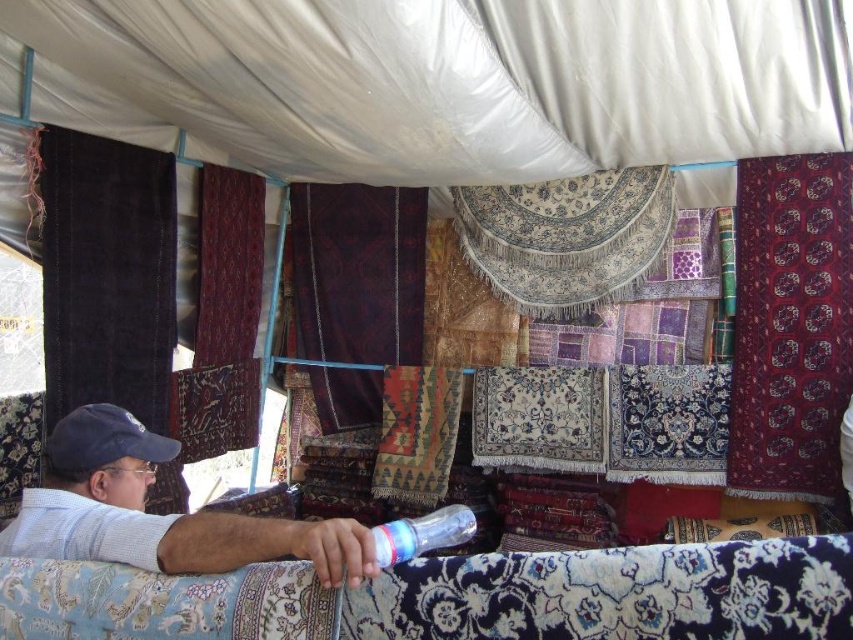
You are a customer at the market stall and want to know which rug is shorter between the black velvet rug at left and the dark velvet rug at center. Can you tell me?

The black velvet rug at left is shorter than the dark velvet rug at center.

You are a customer in the stall and want to pick up the blue fabric baseball cap at lower left. Which direction should you move from the dark velvet rug at center to reach it?

The dark velvet rug at center is positioned on the right side of blue fabric baseball cap at lower left, so you should move to the left from the dark velvet rug at center to reach the blue fabric baseball cap at lower left.

You are setting up a display in the stall and need to place the black velvet rug at left and the white cotton shirt at center. Considering their heights, which item should be placed lower to ensure they are both visible to customers?

The white cotton shirt at center should be placed lower since the black velvet rug at left is taller, allowing both items to be visible to customers.